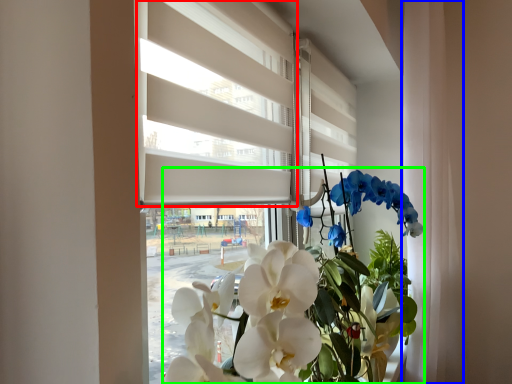
Question: Based on their relative distances, which object is nearer to blind (highlighted by a red box)? Choose from curtain (highlighted by a blue box) and floral arrangement (highlighted by a green box).

Choices:
 (A) curtain
 (B) floral arrangement

Answer: (B)